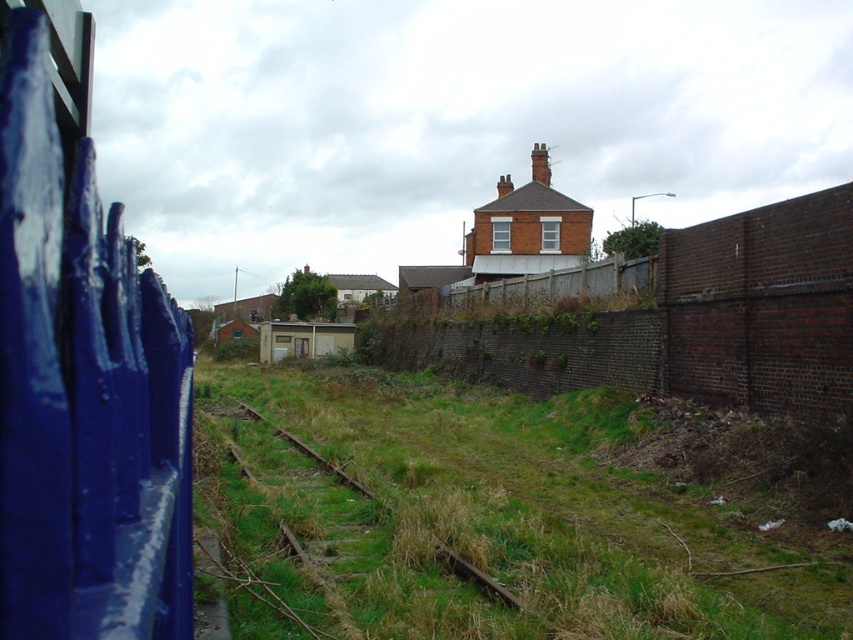
You are standing at the point marked by coordinates point (x=82, y=371) in the image. Looking around, you see the blue painted wood fence at left. Which direction should you face to look towards the residential area?

The blue painted wood fence at left is located at point (x=82, y=371). Since the residential area is in the background of the image, facing away from the fence towards the tracks would orient you towards the residential area.

You are a photographer taking a picture of the railway tracks. You notice two points marked in the scene. Which point, point (781, 582) or point (637, 342), is closer to your camera lens?

Point (781, 582) is closer to the camera lens than point (637, 342).

You are a gardener trying to determine which area requires more attention between the brick wall at center and the green grassy train track at center. Based on their sizes, which one should you prioritize?

The brick wall at center is bigger than the green grassy train track at center, so you should prioritize the brick wall at center for maintenance.